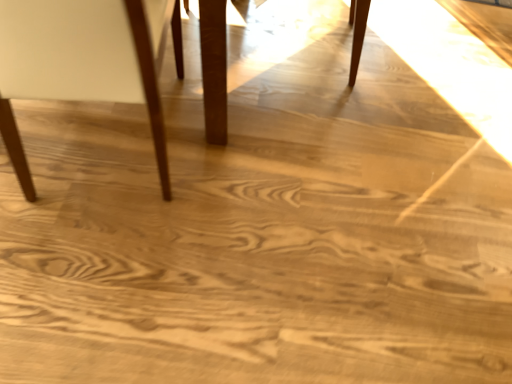
Where is `wooden chair leg at left`? This screenshot has width=512, height=384. wooden chair leg at left is located at coordinates (83, 63).

Describe the element at coordinates (83, 63) in the screenshot. Image resolution: width=512 pixels, height=384 pixels. I see `wooden chair leg at left` at that location.

The width and height of the screenshot is (512, 384). Find the location of `wooden chair leg at left`. wooden chair leg at left is located at coordinates (83, 63).